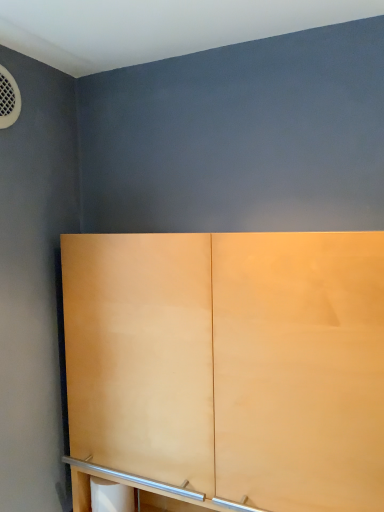
Question: Is matte wood cupboard at center oriented towards white matte toilet paper at lower center?

Choices:
 (A) no
 (B) yes

Answer: (B)

Question: Does matte wood cupboard at center come in front of white matte toilet paper at lower center?

Choices:
 (A) no
 (B) yes

Answer: (B)

Question: Can you confirm if matte wood cupboard at center is bigger than white matte toilet paper at lower center?

Choices:
 (A) no
 (B) yes

Answer: (B)

Question: From the image's perspective, is matte wood cupboard at center over white matte toilet paper at lower center?

Choices:
 (A) no
 (B) yes

Answer: (B)

Question: Are matte wood cupboard at center and white matte toilet paper at lower center located far from each other?

Choices:
 (A) no
 (B) yes

Answer: (A)

Question: Does matte wood cupboard at center have a smaller size compared to white matte toilet paper at lower center?

Choices:
 (A) no
 (B) yes

Answer: (A)

Question: Considering the relative sizes of white matte toilet paper at lower center and matte wood cupboard at center in the image provided, is white matte toilet paper at lower center bigger than matte wood cupboard at center?

Choices:
 (A) no
 (B) yes

Answer: (A)

Question: Does white matte toilet paper at lower center appear on the right side of matte wood cupboard at center?

Choices:
 (A) no
 (B) yes

Answer: (A)

Question: Is white matte toilet paper at lower center facing towards matte wood cupboard at center?

Choices:
 (A) yes
 (B) no

Answer: (A)

Question: Is white matte toilet paper at lower center at the left side of matte wood cupboard at center?

Choices:
 (A) yes
 (B) no

Answer: (A)

Question: Is white matte toilet paper at lower center not inside matte wood cupboard at center?

Choices:
 (A) yes
 (B) no

Answer: (B)

Question: Does white matte toilet paper at lower center have a lesser height compared to matte wood cupboard at center?

Choices:
 (A) yes
 (B) no

Answer: (A)

Question: From a real-world perspective, is matte wood cupboard at center physically located above or below white matte toilet paper at lower center?

Choices:
 (A) below
 (B) above

Answer: (B)